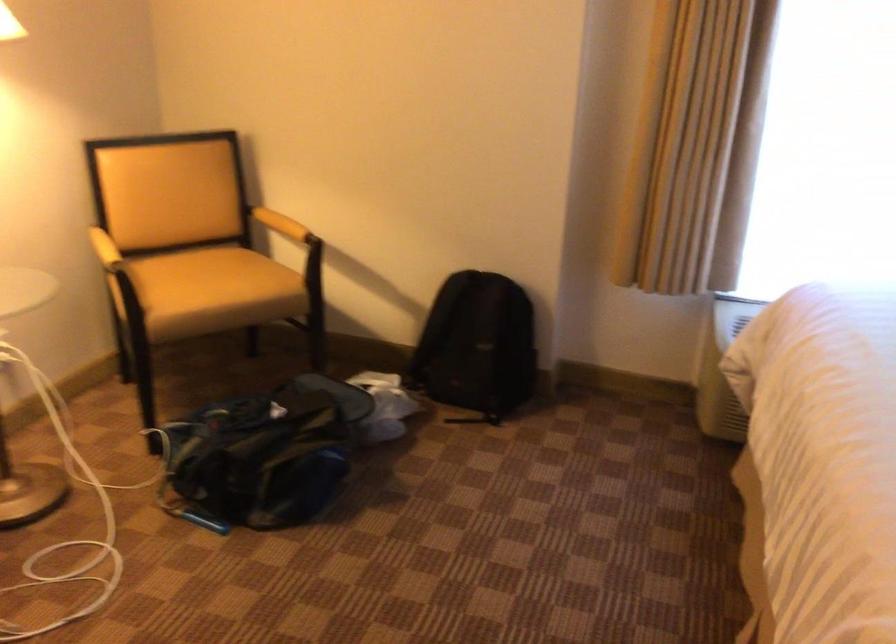
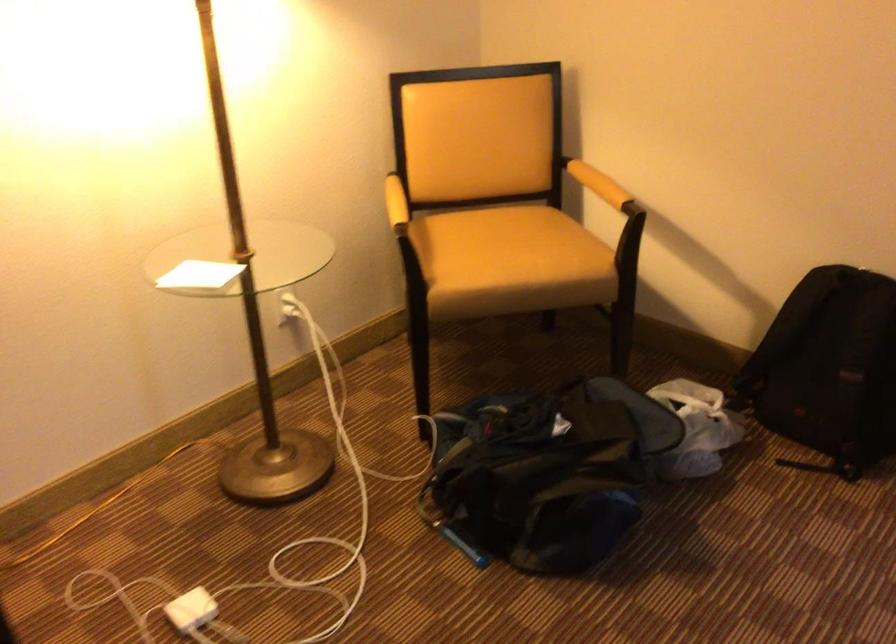
Where in the second image is the point corresponding to (x=218, y=285) from the first image?

(510, 261)